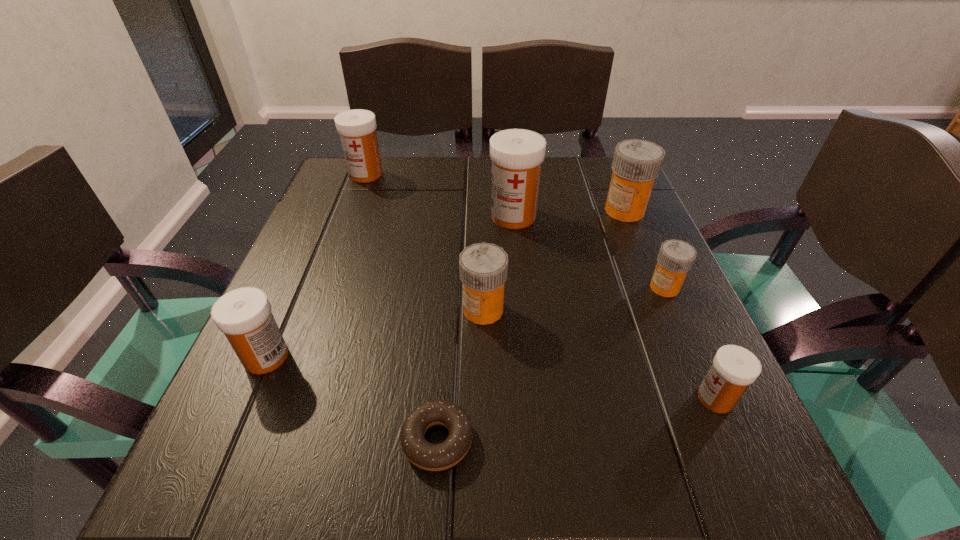
The width and height of the screenshot is (960, 540). I want to click on the nearest white medicine, so click(x=734, y=368).

You are a GUI agent. You are given a task and a screenshot of the screen. Output one action in this format:
    pyautogui.click(x=<x>, y=<y>)
    Task: Click on the brown doughnut
    This screenshot has width=960, height=540.
    Given the screenshot: What is the action you would take?
    [x=432, y=457]

What are the coordinates of `doughnut` in the screenshot? It's located at (432, 457).

Image resolution: width=960 pixels, height=540 pixels. In order to click on free space located 0.310m on the front of the biggest white medicine in this screenshot , I will do `click(526, 346)`.

Image resolution: width=960 pixels, height=540 pixels. What are the coordinates of `vacant space situated 0.380m on the front of the second biggest white medicine` in the screenshot? It's located at (322, 293).

Where is `blank space located on the label side of the biggest orange medicine`? blank space located on the label side of the biggest orange medicine is located at coordinates (441, 211).

The height and width of the screenshot is (540, 960). In order to click on free space located on the label side of the biggest orange medicine in this screenshot , I will do `click(445, 211)`.

The image size is (960, 540). Find the location of `vacant point located 0.110m on the label side of the biggest orange medicine`. vacant point located 0.110m on the label side of the biggest orange medicine is located at coordinates (555, 211).

Identify the location of free region located 0.330m on the label side of the second biggest orange medicine. Image resolution: width=960 pixels, height=540 pixels. (275, 309).

Locate an element on the screen. This screenshot has width=960, height=540. free location located on the label side of the second biggest orange medicine is located at coordinates (394, 309).